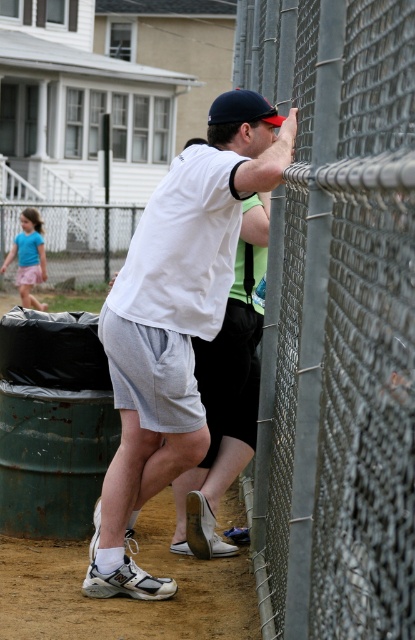
Question: Which object is positioned closest to the matte blue shirt at lower left?

Choices:
 (A) metallic chain-link fence at right
 (B) dark blue fabric baseball cap at upper center
 (C) white matte shorts at center

Answer: (C)

Question: Which point is closer to the camera taking this photo?

Choices:
 (A) (268, 109)
 (B) (39, 259)
 (C) (290, 369)
 (D) (199, 248)

Answer: (C)

Question: Does metallic chain-link fence at right appear under dark blue fabric baseball cap at upper center?

Choices:
 (A) no
 (B) yes

Answer: (B)

Question: Is metallic chain-link fence at right below dark blue fabric baseball cap at upper center?

Choices:
 (A) yes
 (B) no

Answer: (A)

Question: Is metallic chain-link fence at right closer to camera compared to white matte shorts at center?

Choices:
 (A) yes
 (B) no

Answer: (A)

Question: Which object is closer to the camera taking this photo?

Choices:
 (A) matte blue shirt at lower left
 (B) metallic chain-link fence at right
 (C) white matte shorts at center

Answer: (B)